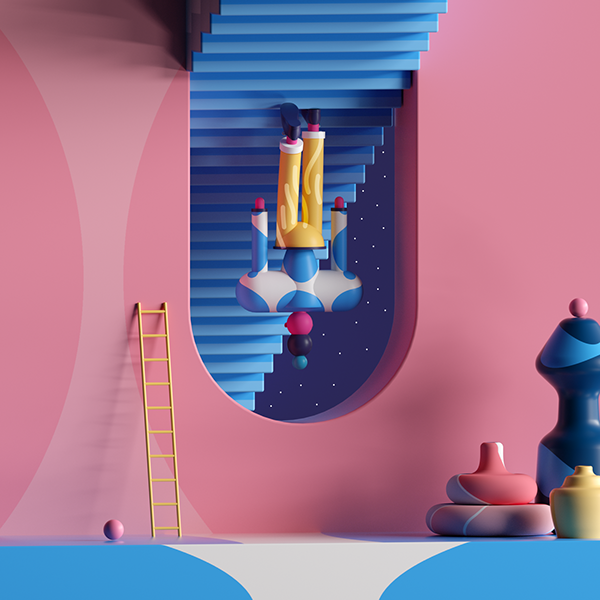
Identify the location of pink wall. [x=494, y=214].